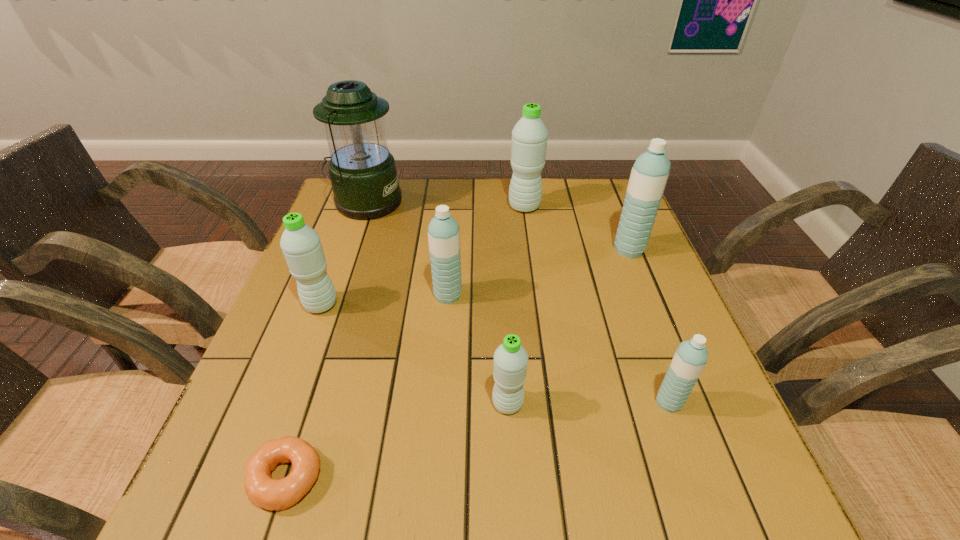
Locate an element on the screen. lantern is located at coordinates (363, 174).

Where is `the third object from right to left`? This screenshot has height=540, width=960. the third object from right to left is located at coordinates (529, 136).

Find the location of a particular element. The image size is (960, 540). the biggest green water bottle is located at coordinates (529, 136).

Find the location of a particular element. This screenshot has height=540, width=960. the sixth nearest object is located at coordinates (650, 172).

Where is `the fifth nearest water bottle`? The image size is (960, 540). the fifth nearest water bottle is located at coordinates (650, 172).

This screenshot has height=540, width=960. I want to click on the second water bottle from left to right, so click(x=444, y=232).

The width and height of the screenshot is (960, 540). I want to click on the second smallest blue water bottle, so (x=444, y=232).

Image resolution: width=960 pixels, height=540 pixels. Identify the location of the second smallest green water bottle. (301, 245).

I want to click on the second nearest green water bottle, so click(x=301, y=245).

Identify the location of the fourth water bottle from right to left. The width and height of the screenshot is (960, 540). (510, 359).